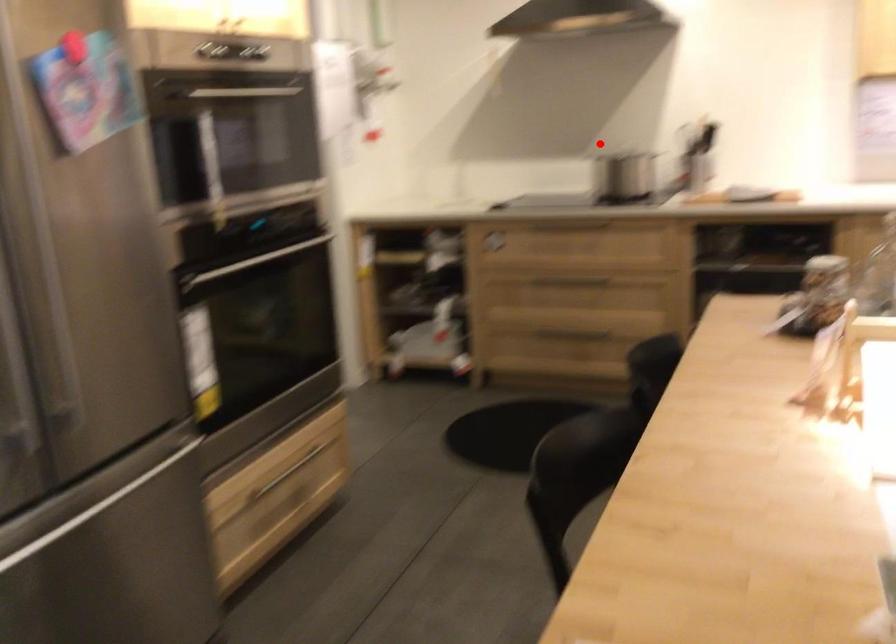
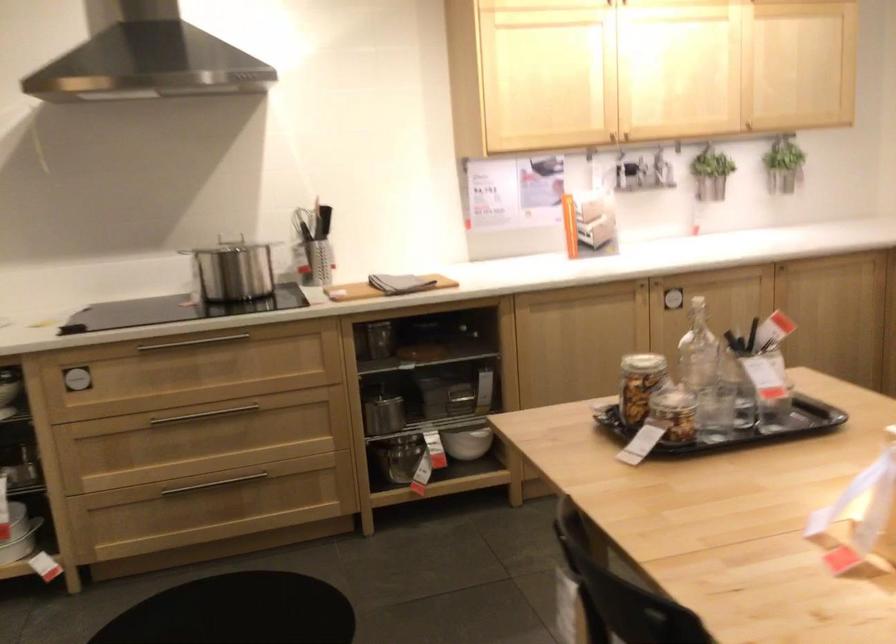
Locate, in the second image, the point that corresponds to the highlighted location in the first image.

(186, 245)